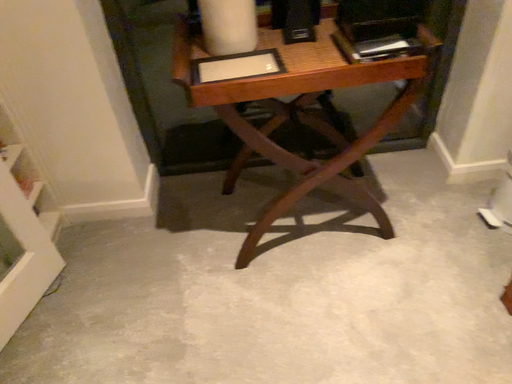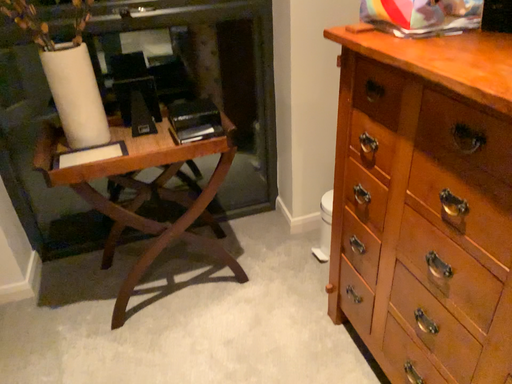
Question: Which way did the camera rotate in the video?

Choices:
 (A) rotated downward
 (B) rotated upward

Answer: (B)